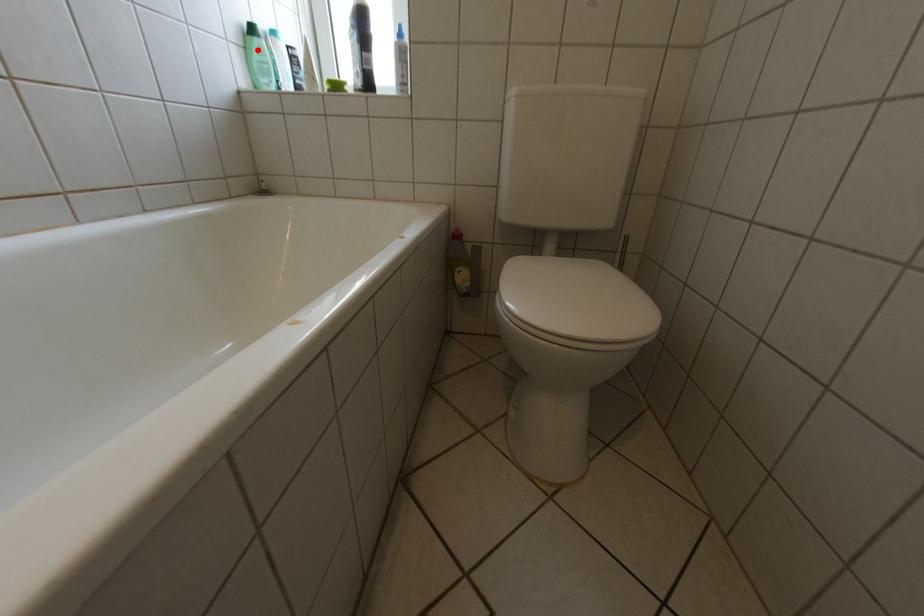
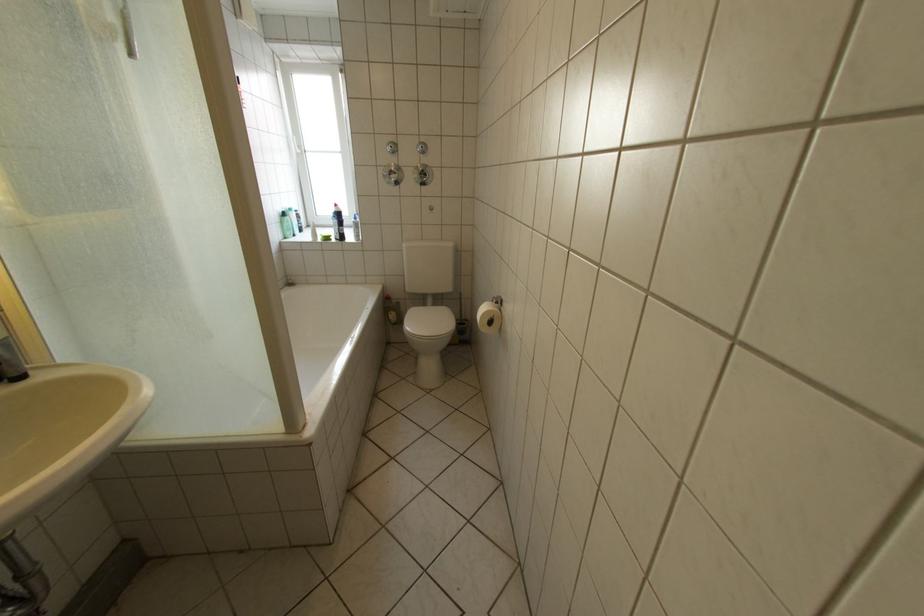
The point at the highlighted location is marked in the first image. Where is the corresponding point in the second image?

(294, 224)